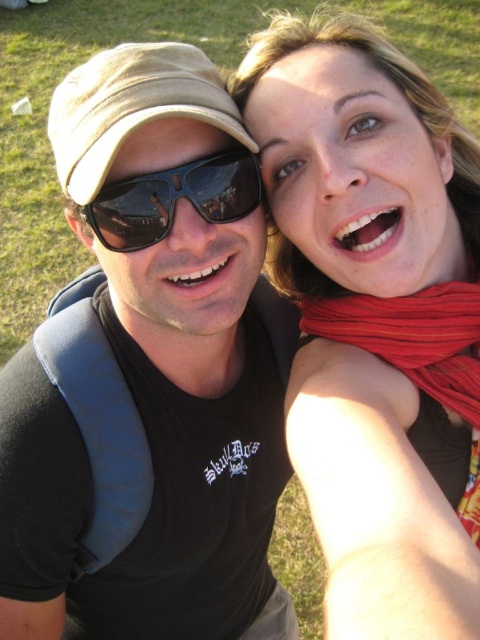
How much distance is there between black matte sunglasses at upper center and matte black scarf at upper right?

The distance of black matte sunglasses at upper center from matte black scarf at upper right is 13.52 inches.

Who is more forward, (16, 396) or (450, 582)?

Positioned in front is point (450, 582).

The image size is (480, 640). In order to click on black matte sunglasses at upper center in this screenshot , I will do `click(149, 376)`.

Does red knitted scarf at upper right come in front of sunglasses at center?

No.

Can you confirm if red knitted scarf at upper right is taller than sunglasses at center?

Yes, red knitted scarf at upper right is taller than sunglasses at center.

Who is more distant from viewer, (441,300) or (140,227)?

Point (441,300)

Find the location of a particular element. This screenshot has height=640, width=480. red knitted scarf at upper right is located at coordinates (412, 337).

Who is shorter, black matte sunglasses at upper center or sunglasses at center?

With less height is sunglasses at center.

Is black matte sunglasses at upper center to the right of sunglasses at center from the viewer's perspective?

Incorrect, black matte sunglasses at upper center is not on the right side of sunglasses at center.

Is point (51, 339) behind point (155, 237)?

That is True.

Identify the location of black matte sunglasses at upper center. This screenshot has height=640, width=480. (149, 376).